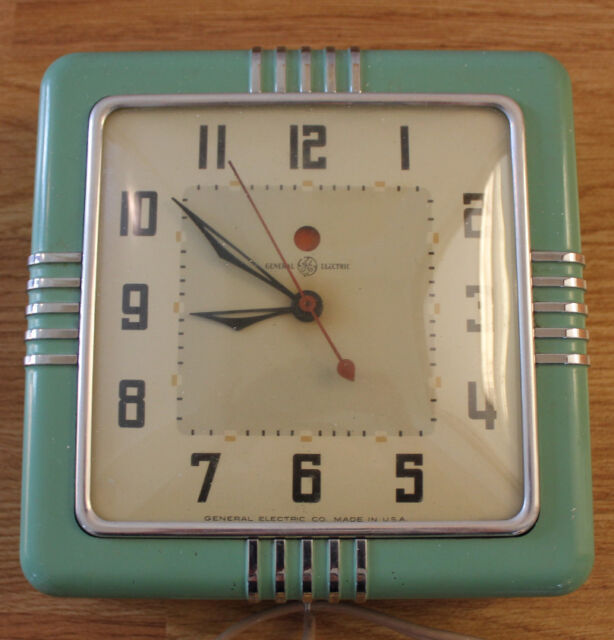
The width and height of the screenshot is (614, 640). What are the coordinates of `corners` in the screenshot? It's located at (37, 564), (573, 570), (552, 61), (58, 67).